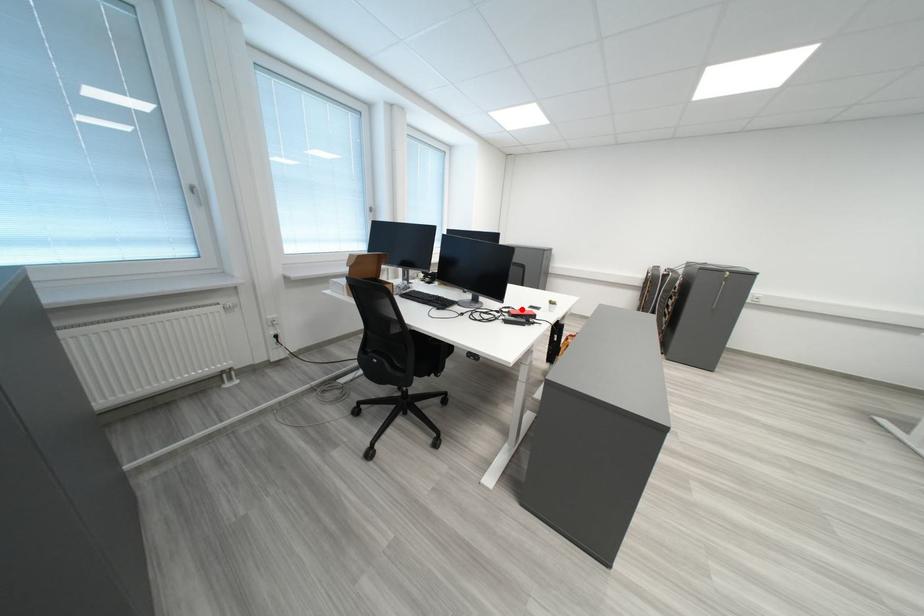
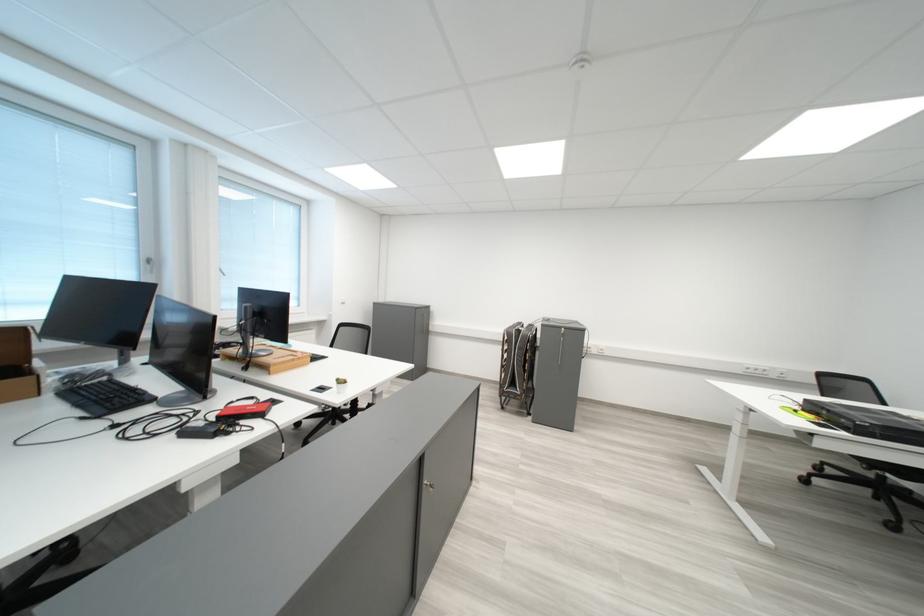
Locate, in the second image, the point that corresponds to the highlighted location in the first image.

(264, 400)